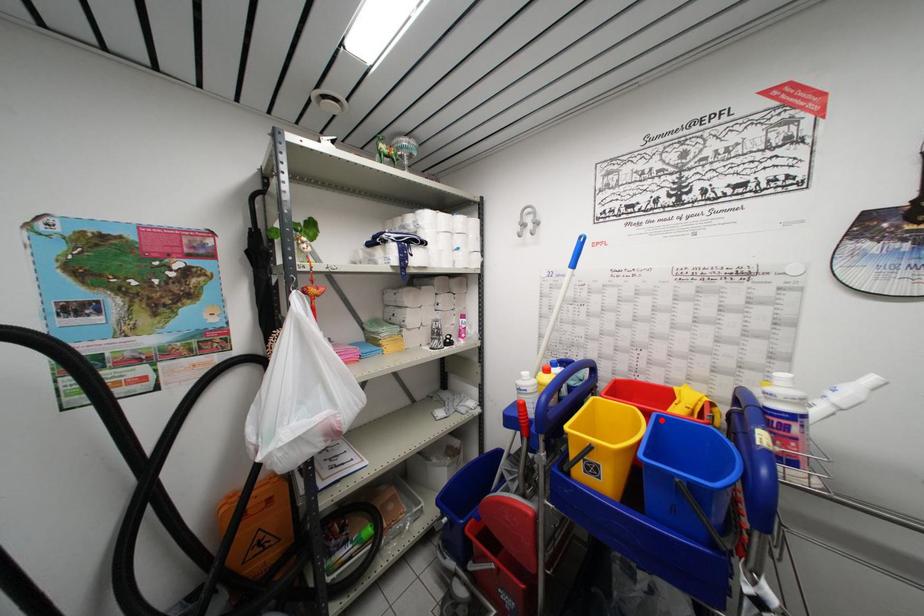
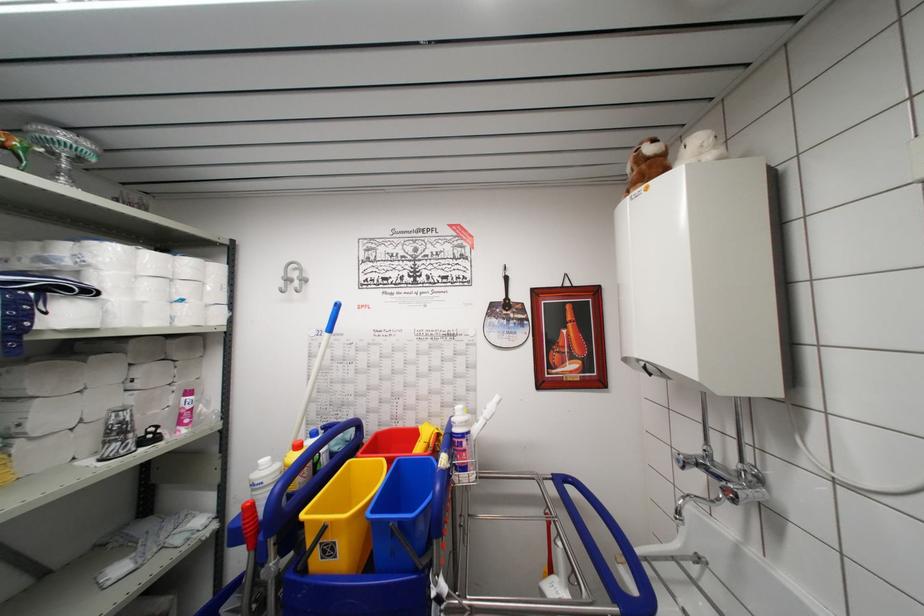
Find the pixel in the second image that matches the highlighted location in the first image.

(402, 466)